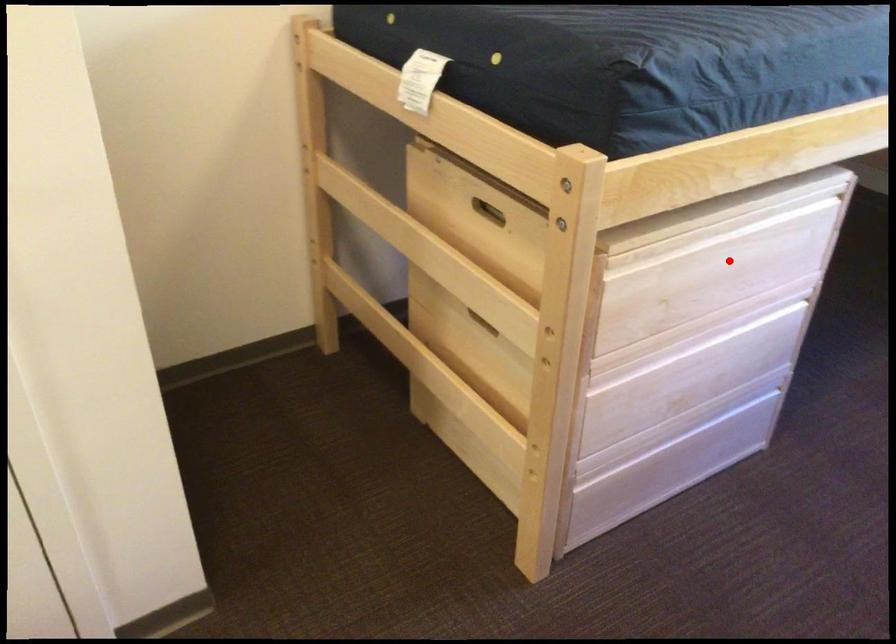
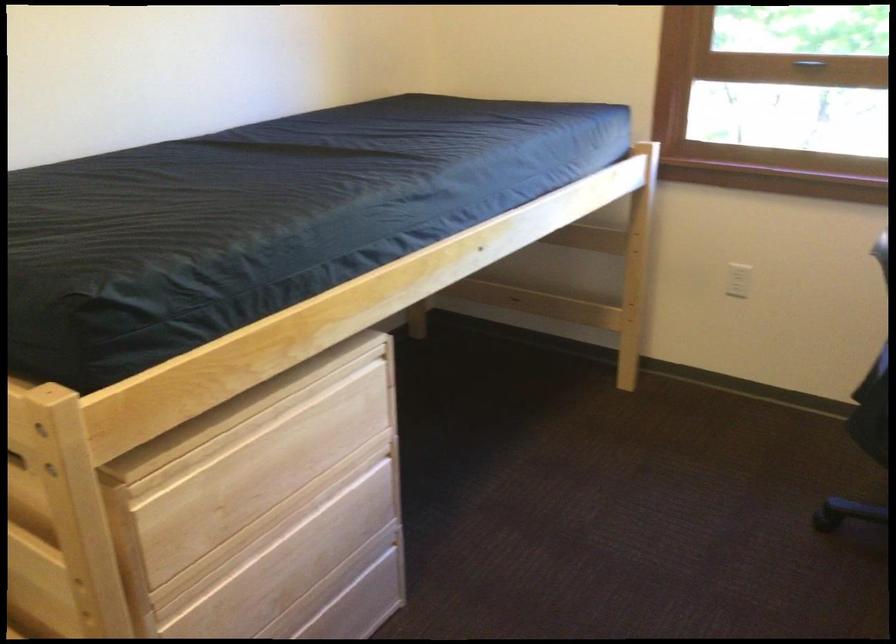
In the second image, find the point that corresponds to the highlighted location in the first image.

(285, 448)